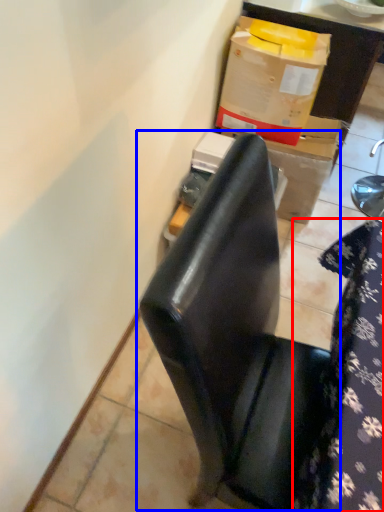
Question: Which of the following is the closest to the observer, tablecloth (highlighted by a red box) or chair (highlighted by a blue box)?

Choices:
 (A) tablecloth
 (B) chair

Answer: (B)